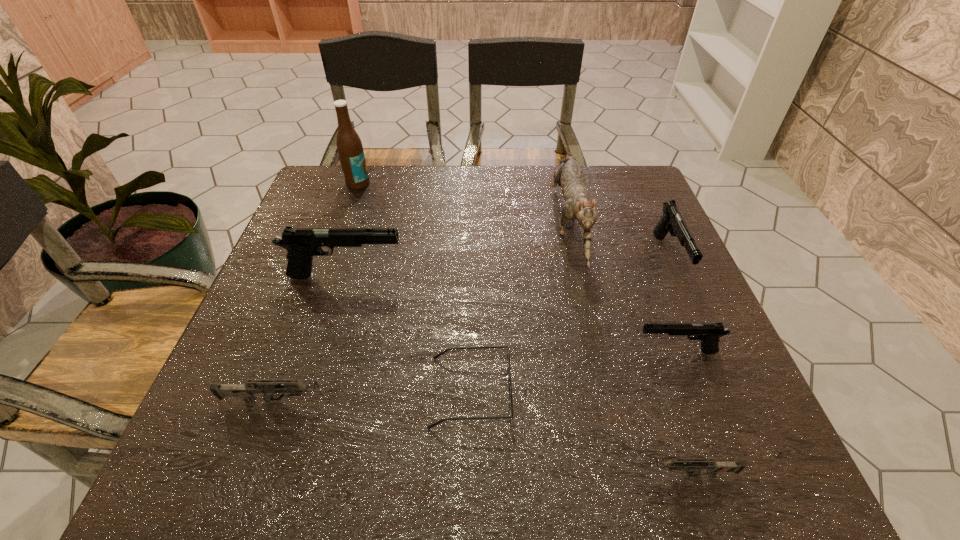
You are a GUI agent. You are given a task and a screenshot of the screen. Output one action in this format:
    pyautogui.click(x=<x>, y=<y>)
    Task: Click on the second closest gun to the third shortest object
    The height and width of the screenshot is (540, 960).
    Given the screenshot: What is the action you would take?
    pyautogui.click(x=695, y=465)

Where is `black gun that is the third closest to the fourth farthest gun`? black gun that is the third closest to the fourth farthest gun is located at coordinates (672, 221).

Identify which black gun is the second nearest to the tallest object. Please provide its 2D coordinates. Your answer should be formatted as a tuple, i.e. [(x, y)], where the tuple contains the x and y coordinates of a point satisfying the conditions above.

[(672, 221)]

Where is `free space in the image that satisfies the following two spatial constraints: 1. on the face of the second tallest object; 2. aimed along the barrel of the second nearest gun`? Image resolution: width=960 pixels, height=540 pixels. free space in the image that satisfies the following two spatial constraints: 1. on the face of the second tallest object; 2. aimed along the barrel of the second nearest gun is located at coordinates (608, 401).

Find the location of a particular element. vacant space that satisfies the following two spatial constraints: 1. at the aiming end of the second biggest black gun; 2. at the aiming end of the biggest black gun is located at coordinates (677, 276).